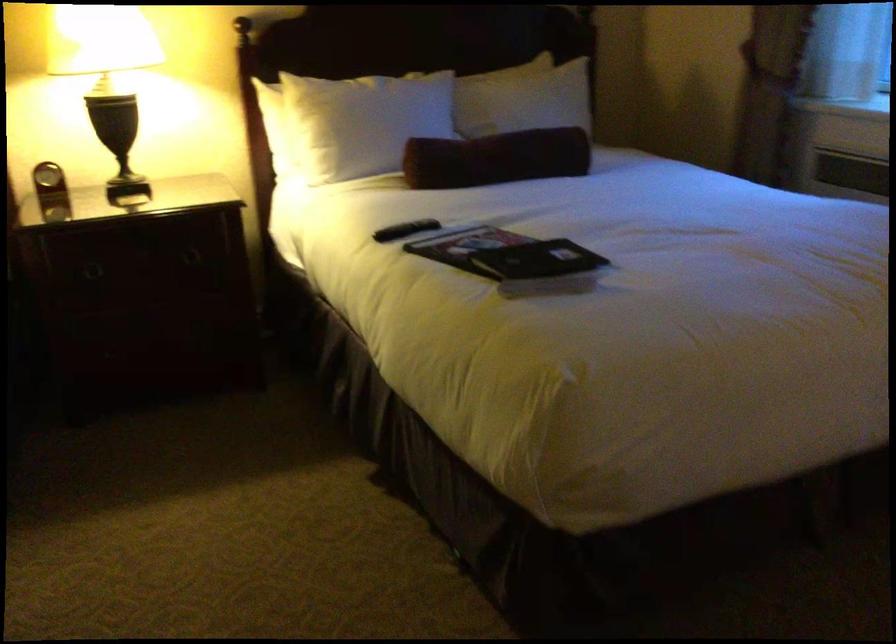
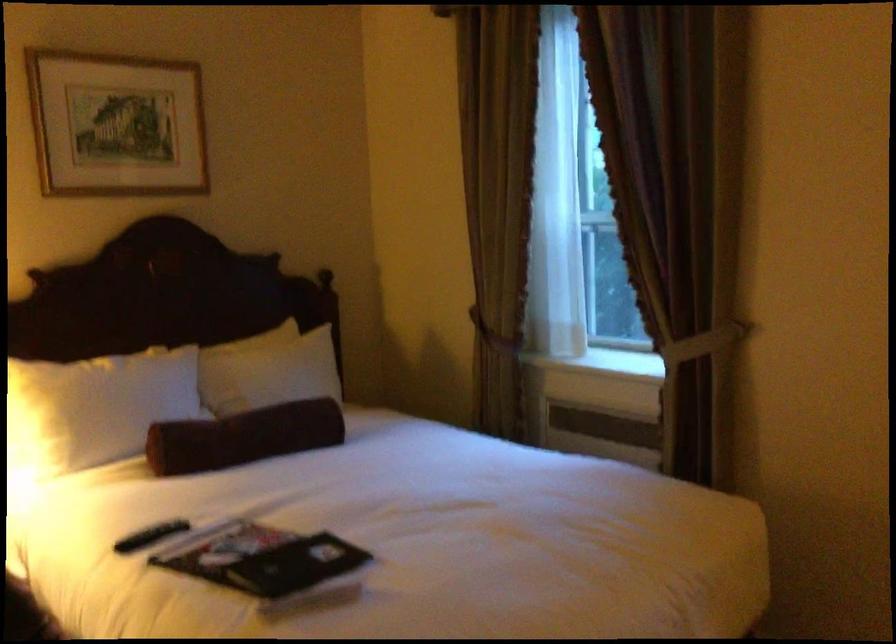
Where in the second image is the point corresponding to point 762,71 from the first image?

(494, 334)